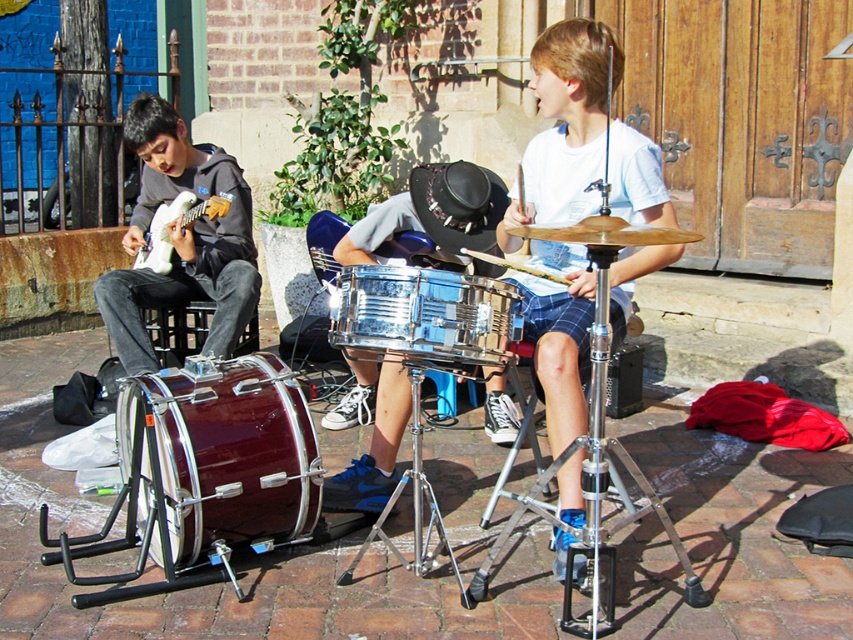
Question: Which object appears farthest from the camera in this image?

Choices:
 (A) white matte drum at center
 (B) maroon polished drum at lower left
 (C) clear plastic drum at center
 (D) matte black guitar at left

Answer: (D)

Question: Which object is closer to the camera taking this photo?

Choices:
 (A) white matte drum at center
 (B) shiny silver drum at center
 (C) matte black guitar at left

Answer: (A)

Question: Estimate the real-world distances between objects in this image. Which object is farther from the shiny silver drum at center?

Choices:
 (A) maroon polished drum at lower left
 (B) clear plastic drum at center
 (C) white matte drum at center

Answer: (B)

Question: Is white matte drum at center further to camera compared to clear plastic drum at center?

Choices:
 (A) yes
 (B) no

Answer: (A)

Question: Can you confirm if maroon polished drum at lower left is positioned above matte black guitar at left?

Choices:
 (A) yes
 (B) no

Answer: (B)

Question: Considering the relative positions of maroon polished drum at lower left and shiny silver drum at center in the image provided, where is maroon polished drum at lower left located with respect to shiny silver drum at center?

Choices:
 (A) below
 (B) above

Answer: (A)